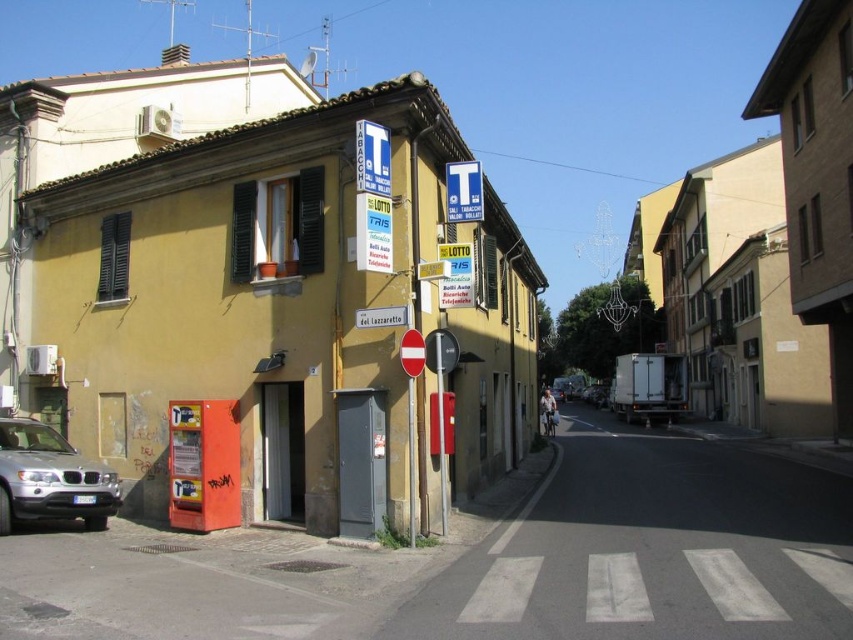
You are standing at the corner of the street in front of the red LOTTO and TRIS shop. You want to walk to the concrete sidewalk at lower center. Which direction should you move relative to the shop?

You should move towards the concrete sidewalk at lower center, which is located at point (653,548). Since the shop is on the left building with a corner structure, moving towards the lower center would mean heading diagonally away from the shop towards the center of the street.

You are a delivery person with a 2.5 meter wide cart. You need to move along the street while avoiding obstacles. Can your cart fit along the concrete sidewalk at lower center next to the silver metallic suv at lower left?

The concrete sidewalk at lower center is wider than the silver metallic suv at lower left. Since the sidewalk is wider than the suv, it might be possible to fit the 2.5 meter wide cart alongside the suv on the sidewalk. However, the exact feasibility depends on the combined space required for both the suv and the cart on the sidewalk. Without knowing the exact width of the sidewalk, it is difficult to confirm.